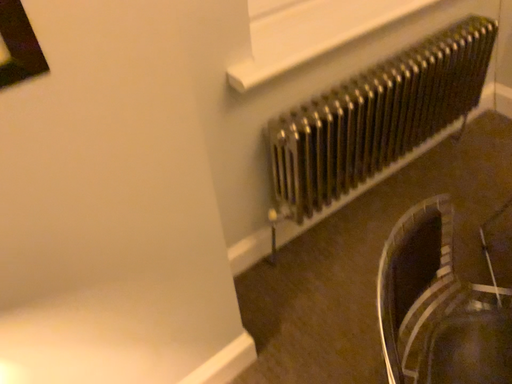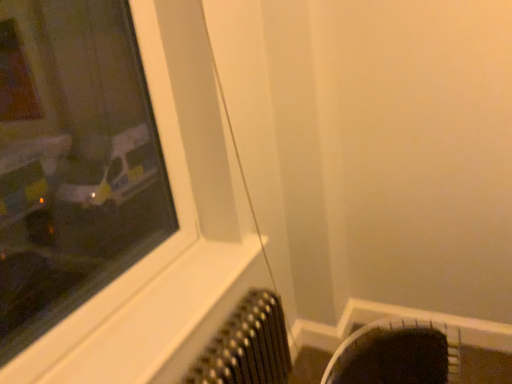
Question: How did the camera likely rotate when shooting the video?

Choices:
 (A) rotated right
 (B) rotated left

Answer: (A)